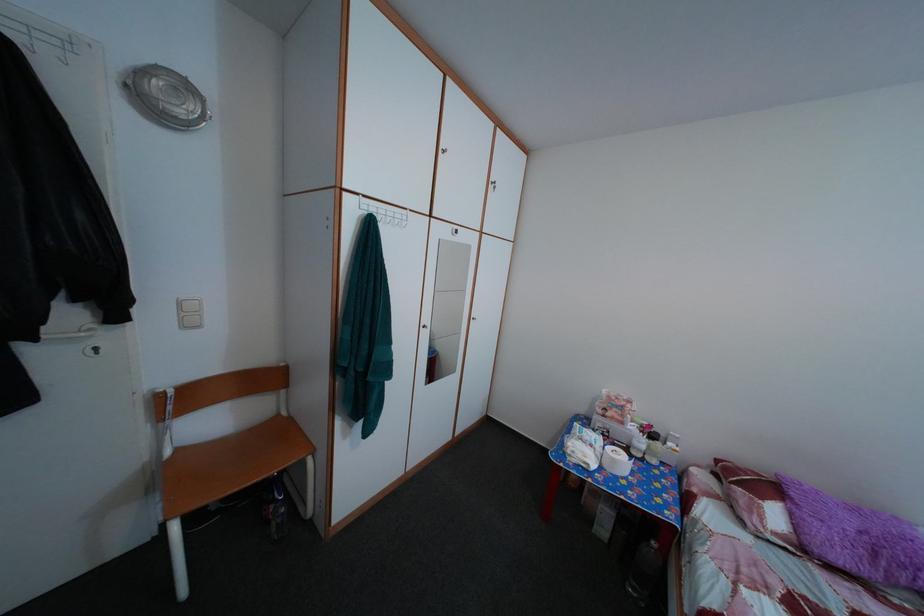
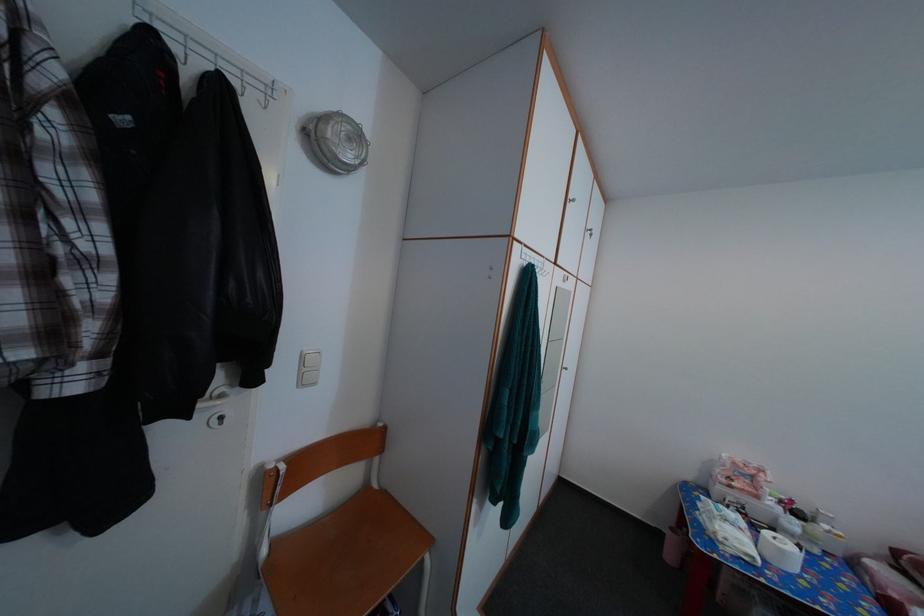
In the second image, find the point that corresponds to [67,51] in the first image.

(272, 95)